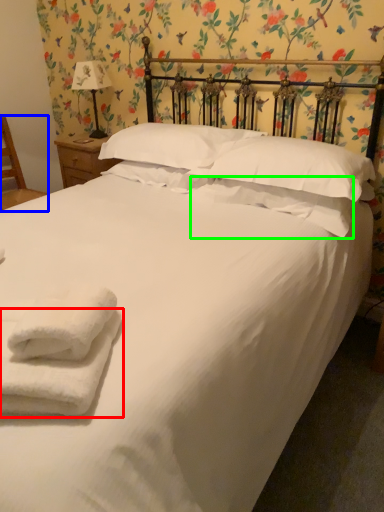
Question: Estimate the real-world distances between objects in this image. Which object is closer to towel (highlighted by a red box), armchair (highlighted by a blue box) or pillow (highlighted by a green box)?

Choices:
 (A) armchair
 (B) pillow

Answer: (B)